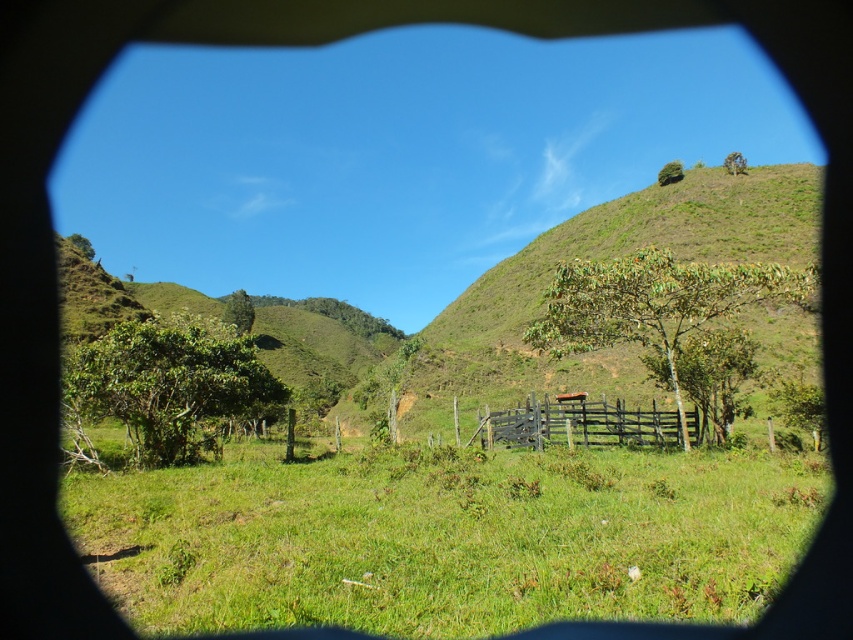
Question: Which point is closer to the camera?

Choices:
 (A) [276, 552]
 (B) [506, 445]

Answer: (A)

Question: Is green grassy field at center thinner than wooden fence at center?

Choices:
 (A) no
 (B) yes

Answer: (A)

Question: Which of the following is the farthest from the observer?

Choices:
 (A) wooden fence at center
 (B) green grassy field at center

Answer: (A)

Question: Does green grassy field at center appear on the right side of wooden fence at center?

Choices:
 (A) no
 (B) yes

Answer: (A)

Question: Can you confirm if green grassy field at center is positioned to the left of wooden fence at center?

Choices:
 (A) yes
 (B) no

Answer: (A)